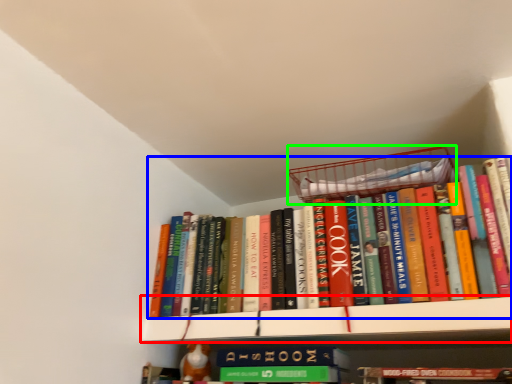
Question: Based on their relative distances, which object is farther from shelf (highlighted by a red box)? Choose from book (highlighted by a blue box) and basket (highlighted by a green box).

Choices:
 (A) book
 (B) basket

Answer: (B)